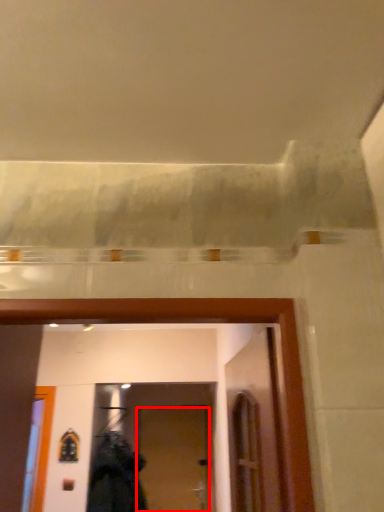
Question: Considering the relative positions of door (annotated by the red box) and clothing in the image provided, where is door (annotated by the red box) located with respect to the staircase?

Choices:
 (A) left
 (B) right

Answer: (B)